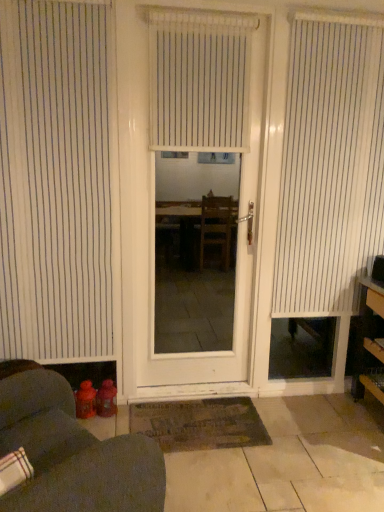
Where is `vacant space situated on the left part of wooden shelves at right`? The width and height of the screenshot is (384, 512). vacant space situated on the left part of wooden shelves at right is located at coordinates (330, 422).